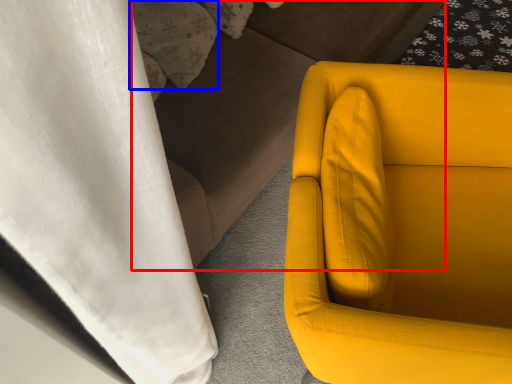
Question: Which point is closer to the camera, couch (highlighted by a red box) or pillow (highlighted by a blue box)?

Choices:
 (A) couch
 (B) pillow

Answer: (A)